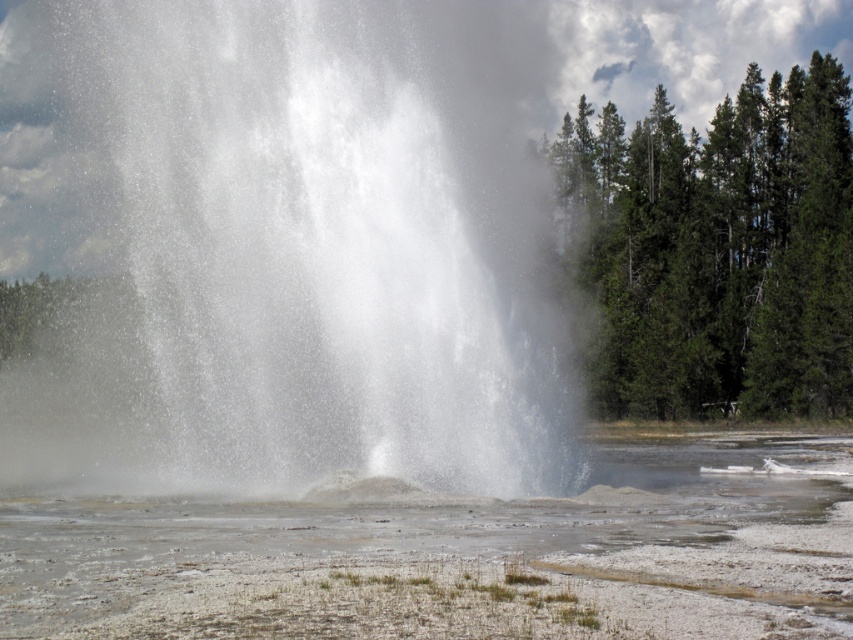
Is point (146, 262) closer to viewer compared to point (236, 566)?

No, (146, 262) is behind (236, 566).

What do you see at coordinates (337, 237) in the screenshot?
I see `white vapor at center` at bounding box center [337, 237].

Locate an element on the screen. white vapor at center is located at coordinates (337, 237).